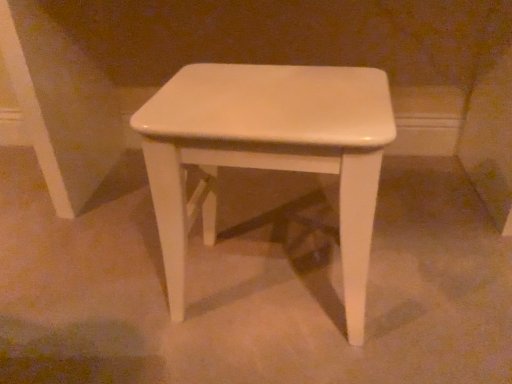
Image resolution: width=512 pixels, height=384 pixels. I want to click on white glossy stool at center, so click(x=267, y=152).

In the scene shown: What is the approximate height of white glossy stool at center?

45.31 centimeters.

The image size is (512, 384). Describe the element at coordinates (267, 152) in the screenshot. I see `white glossy stool at center` at that location.

Find the location of `white glossy stool at center`. white glossy stool at center is located at coordinates (267, 152).